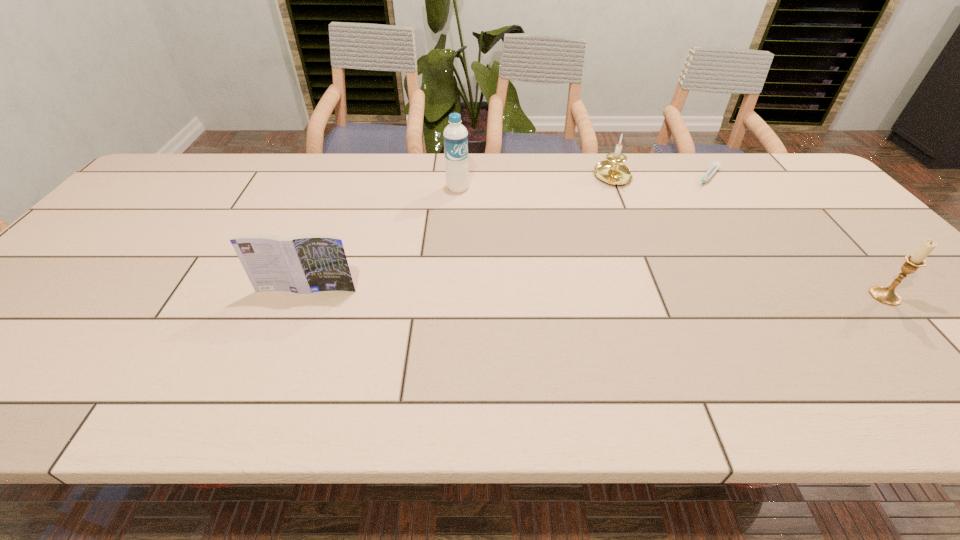
Where is `vacant space that's between the shorter candle holder and the rightmost object`? vacant space that's between the shorter candle holder and the rightmost object is located at coordinates (749, 237).

Image resolution: width=960 pixels, height=540 pixels. In order to click on vacant area between the book and the nearer candle holder in this screenshot , I will do `click(595, 293)`.

Where is `vacant area between the third object from right to left and the syringe`? Image resolution: width=960 pixels, height=540 pixels. vacant area between the third object from right to left and the syringe is located at coordinates (660, 178).

Find the location of a particular element. Image resolution: width=960 pixels, height=540 pixels. free area in between the book and the syringe is located at coordinates (507, 234).

I want to click on vacant area between the shortest object and the nearer candle holder, so click(x=796, y=237).

Image resolution: width=960 pixels, height=540 pixels. Identify the location of free space between the second object from left to right and the leftmost object. (382, 239).

The image size is (960, 540). Identify the location of blank region between the tallest object and the rightmost object. (671, 242).

Locate an element on the screen. Image resolution: width=960 pixels, height=540 pixels. vacant area that lies between the syringe and the book is located at coordinates (507, 234).

Identify the location of free space between the fourth object from left to right and the book. (507, 234).

Image resolution: width=960 pixels, height=540 pixels. Identify the location of free point between the rightmost object and the water bottle. pos(671,242).